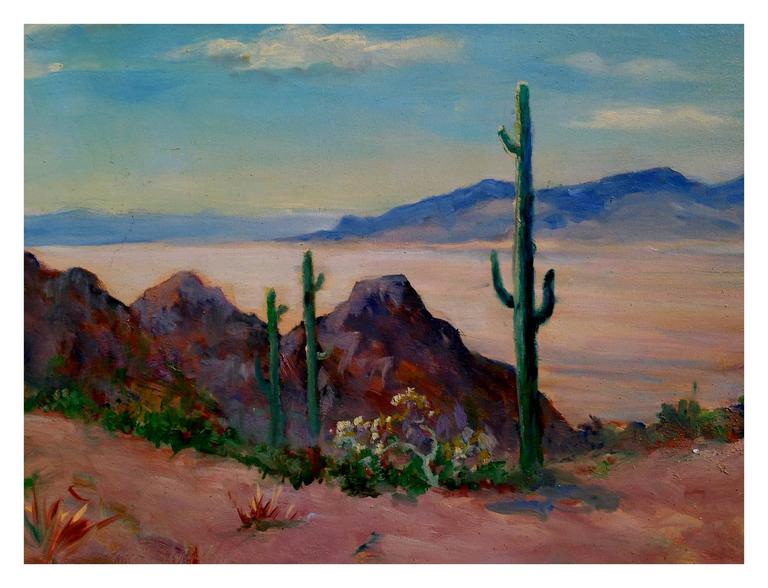
This screenshot has width=768, height=588. I want to click on left cactus, so click(x=273, y=349).